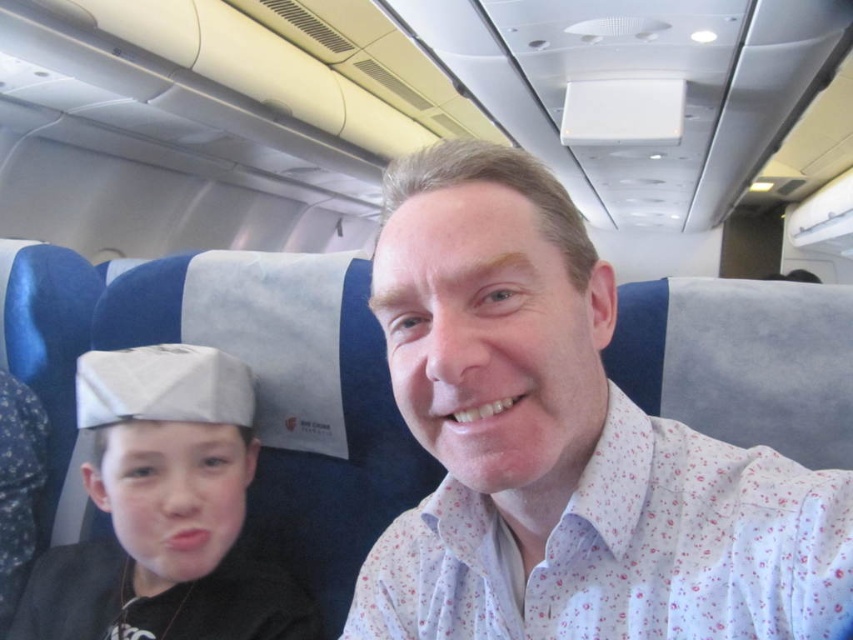
Question: Which object appears farthest from the camera in this image?

Choices:
 (A) gray fabric cap at left
 (B) white floral shirt at center

Answer: (A)

Question: Does white floral shirt at center come in front of gray fabric cap at left?

Choices:
 (A) no
 (B) yes

Answer: (B)

Question: Among these points, which one is farthest from the camera?

Choices:
 (A) (80, 424)
 (B) (471, 282)

Answer: (A)

Question: Which point is farther to the camera?

Choices:
 (A) (601, 490)
 (B) (107, 561)

Answer: (B)

Question: Can you confirm if white floral shirt at center is positioned above gray fabric cap at left?

Choices:
 (A) yes
 (B) no

Answer: (A)

Question: Can you confirm if white floral shirt at center is smaller than gray fabric cap at left?

Choices:
 (A) yes
 (B) no

Answer: (A)